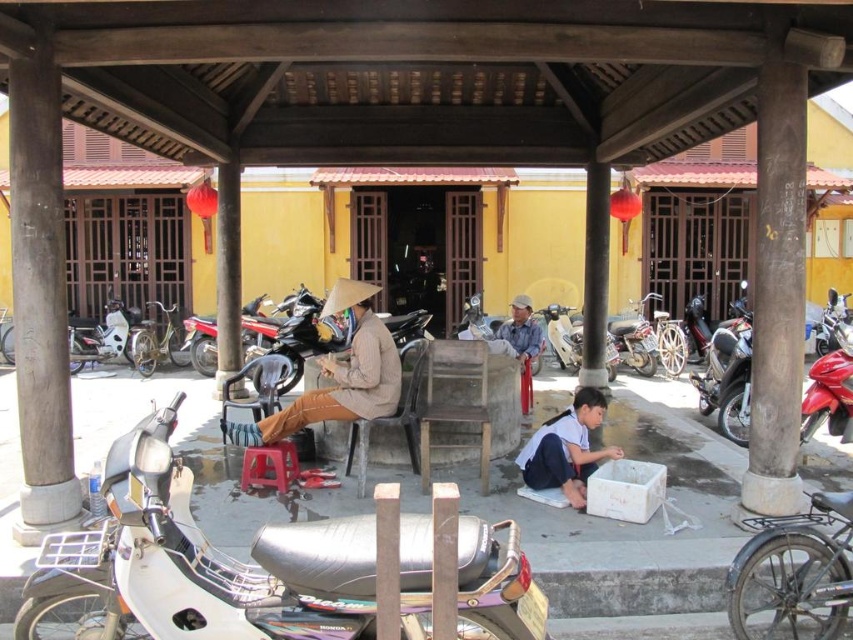
You are a delivery person who needs to load a package onto the white matte motorcycle at left. The package must be placed at a height that the white cotton shirt at lower center can reach. What is the maximum height you can place the package?

The white cotton shirt at lower center is not as tall as the white matte motorcycle at left, so the maximum height the package can be placed is at the height of the white cotton shirt at lower center to ensure it can be reached.